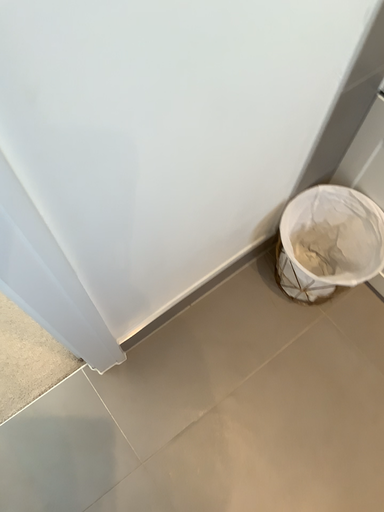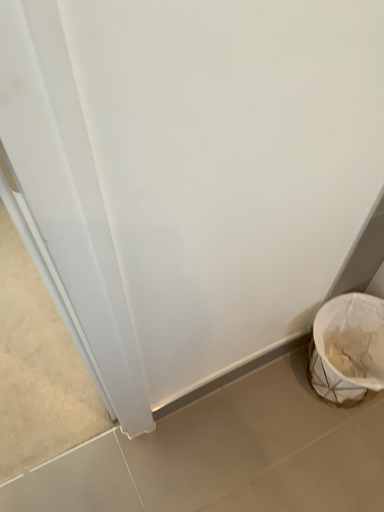
Question: How did the camera likely rotate when shooting the video?

Choices:
 (A) rotated upward
 (B) rotated downward

Answer: (A)